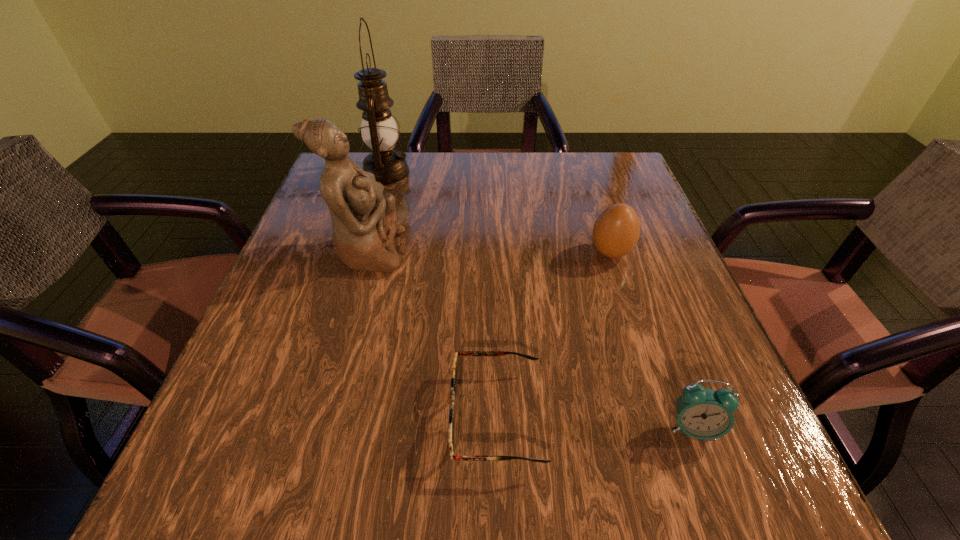
What are the coordinates of `object situated at the far left corner` in the screenshot? It's located at (379, 131).

In the image, there is a desktop. In order to click on vacant space at the far edge in this screenshot , I will do `click(482, 154)`.

Locate an element on the screen. This screenshot has height=540, width=960. free region at the left edge of the desktop is located at coordinates (306, 313).

The height and width of the screenshot is (540, 960). In the image, there is a desktop. What are the coordinates of `vacant space at the right edge` in the screenshot? It's located at point(660,237).

Find the location of a particular element. blank area at the near left corner is located at coordinates (200, 509).

Where is `vacant position at the far right corner of the desktop`? The image size is (960, 540). vacant position at the far right corner of the desktop is located at coordinates (637, 185).

You are a GUI agent. You are given a task and a screenshot of the screen. Output one action in this format:
    pyautogui.click(x=<x>, y=<y>)
    Task: Click on the free space at the near right corner of the desktop
    The image size is (960, 540).
    Given the screenshot: What is the action you would take?
    pyautogui.click(x=721, y=462)

Locate an element on the screen. This screenshot has height=540, width=960. vacant area between the boiled egg and the oil lamp is located at coordinates (498, 213).

Where is `free space between the alarm clock and the third object from right to left`? The image size is (960, 540). free space between the alarm clock and the third object from right to left is located at coordinates (594, 422).

Find the location of a particular element. This screenshot has width=960, height=540. free space between the boiled egg and the second shortest object is located at coordinates (x=652, y=340).